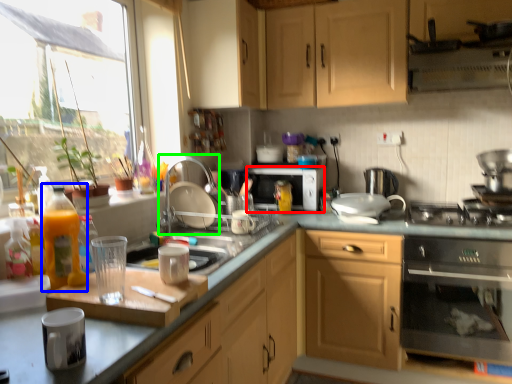
Question: Which object is the closest to the microwave oven (highlighted by a red box)? Choose among these: bottle (highlighted by a blue box) or faucet (highlighted by a green box).

Choices:
 (A) bottle
 (B) faucet

Answer: (B)